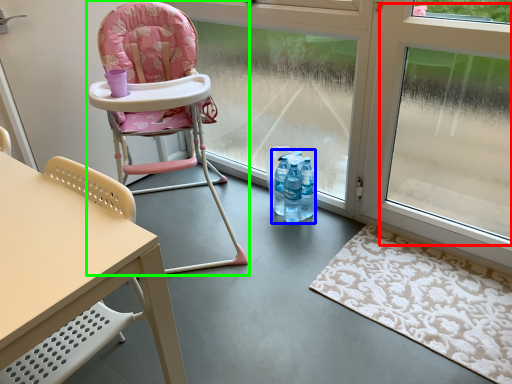
Question: Based on their relative distances, which object is nearer to window screen (highlighted by a red box)? Choose from bottle (highlighted by a blue box) and chair (highlighted by a green box).

Choices:
 (A) bottle
 (B) chair

Answer: (A)